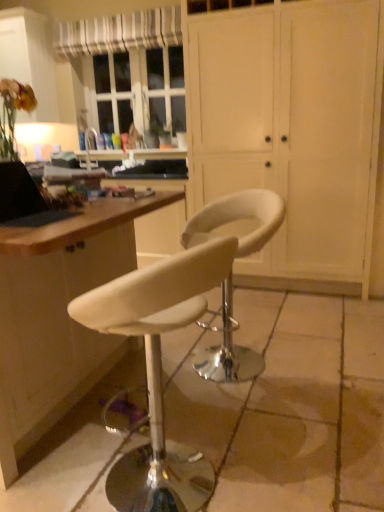
Question: From the image's perspective, is matte white cabinet at upper left over white striped fabric at upper left?

Choices:
 (A) no
 (B) yes

Answer: (A)

Question: Does matte white cabinet at upper left lie behind white striped fabric at upper left?

Choices:
 (A) yes
 (B) no

Answer: (A)

Question: Does matte white cabinet at upper left appear on the left side of white striped fabric at upper left?

Choices:
 (A) no
 (B) yes

Answer: (B)

Question: Considering the relative positions of matte white cabinet at upper left and white striped fabric at upper left in the image provided, is matte white cabinet at upper left to the right of white striped fabric at upper left from the viewer's perspective?

Choices:
 (A) no
 (B) yes

Answer: (A)

Question: Is matte white cabinet at upper left placed right next to white striped fabric at upper left?

Choices:
 (A) yes
 (B) no

Answer: (B)

Question: Is matte white cabinet at upper left looking in the opposite direction of white striped fabric at upper left?

Choices:
 (A) no
 (B) yes

Answer: (A)

Question: From the image's perspective, is white leather stool at center, which appears as the first chair when viewed from the back, located beneath white matte cabinet at center?

Choices:
 (A) no
 (B) yes

Answer: (B)

Question: Is white matte cabinet at center surrounded by white leather stool at center, which appears as the first chair when viewed from the back?

Choices:
 (A) no
 (B) yes

Answer: (A)

Question: Is white leather stool at center, which appears as the first chair when viewed from the back, far away from white matte cabinet at center?

Choices:
 (A) no
 (B) yes

Answer: (B)

Question: Is white leather stool at center, placed as the second chair when sorted from front to back, facing away from white matte cabinet at center?

Choices:
 (A) no
 (B) yes

Answer: (B)

Question: Is the position of white leather stool at center, placed as the second chair when sorted from front to back, less distant than that of white matte cabinet at center?

Choices:
 (A) no
 (B) yes

Answer: (B)

Question: Can you confirm if white leather stool at center, placed as the second chair when sorted from front to back, is positioned to the right of white matte cabinet at center?

Choices:
 (A) yes
 (B) no

Answer: (B)

Question: Is white striped fabric at upper left smaller than black matte laptop at left?

Choices:
 (A) yes
 (B) no

Answer: (B)